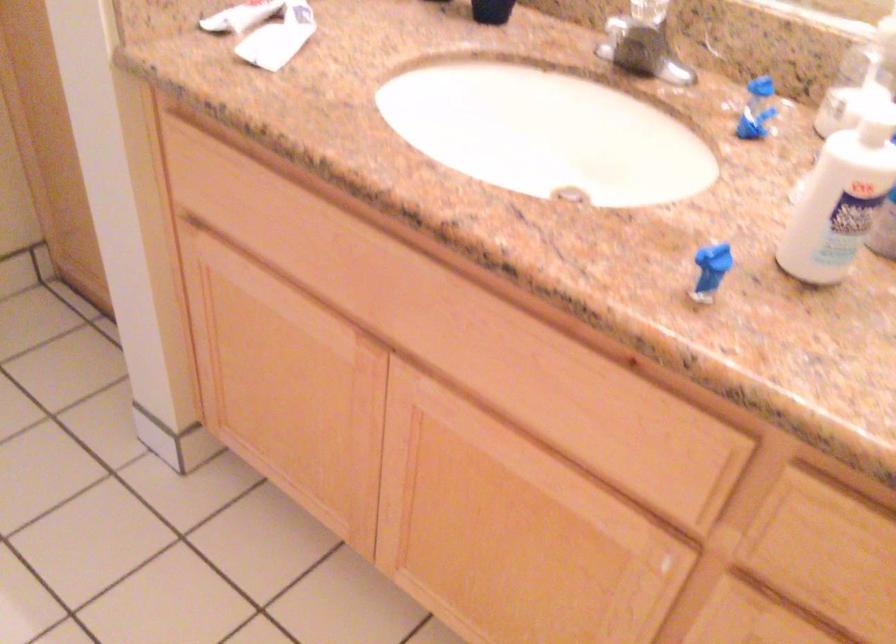
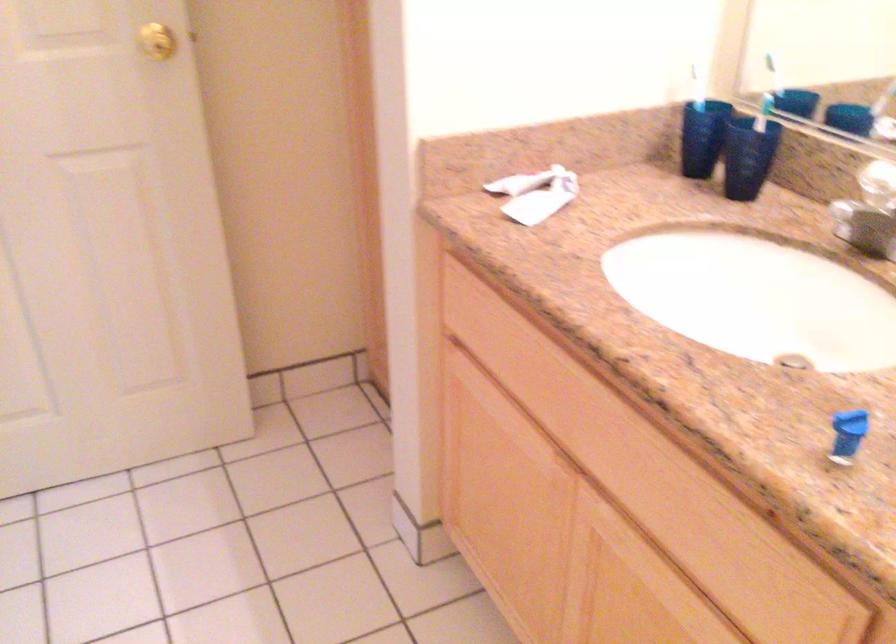
In a continuous first-person perspective shot, in which direction is the camera moving?

The movement direction of the cameraman is right, backward.